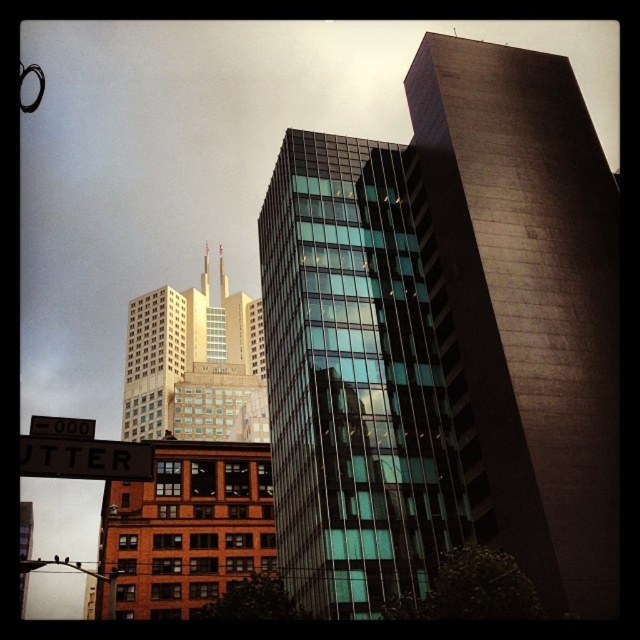
Question: Based on their relative distances, which object is farther from the brown wooden street sign at lower left?

Choices:
 (A) gold glass skyscraper at center
 (B) glassy steel building at center

Answer: (A)

Question: Is glassy steel building at center closer to the viewer compared to gold glass skyscraper at center?

Choices:
 (A) yes
 (B) no

Answer: (A)

Question: Can you confirm if gold glass skyscraper at center is bigger than brown wooden street sign at lower left?

Choices:
 (A) no
 (B) yes

Answer: (B)

Question: Considering the real-world distances, which object is farthest from the glassy steel building at center?

Choices:
 (A) brown wooden street sign at lower left
 (B) gold glass skyscraper at center

Answer: (B)

Question: Which object is positioned closest to the glassy steel building at center?

Choices:
 (A) brown wooden street sign at lower left
 (B) gold glass skyscraper at center

Answer: (A)

Question: Is gold glass skyscraper at center wider than brown wooden street sign at lower left?

Choices:
 (A) no
 (B) yes

Answer: (B)